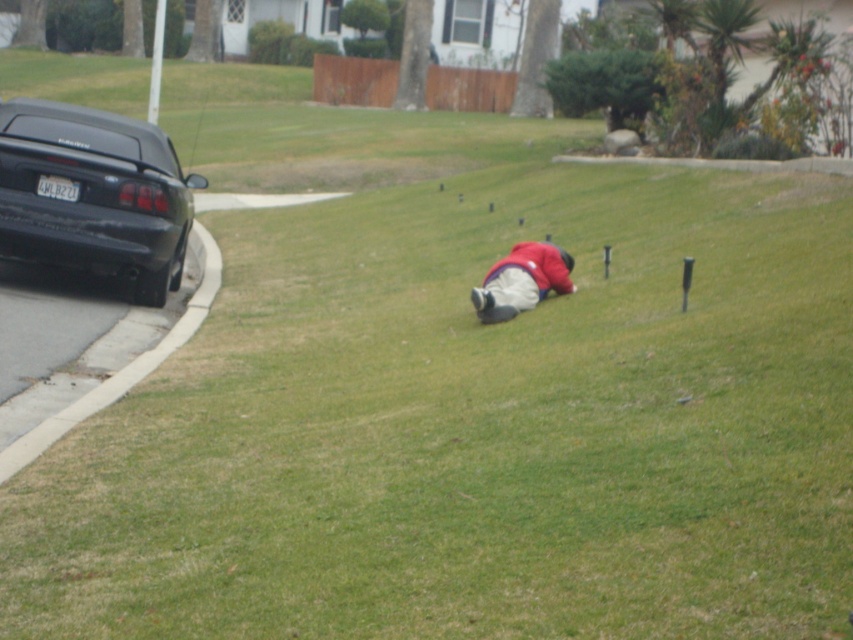
Can you confirm if black matte car at left is positioned to the right of red matte jacket at center?

Incorrect, black matte car at left is not on the right side of red matte jacket at center.

The image size is (853, 640). In order to click on black matte car at left in this screenshot , I will do `click(93, 195)`.